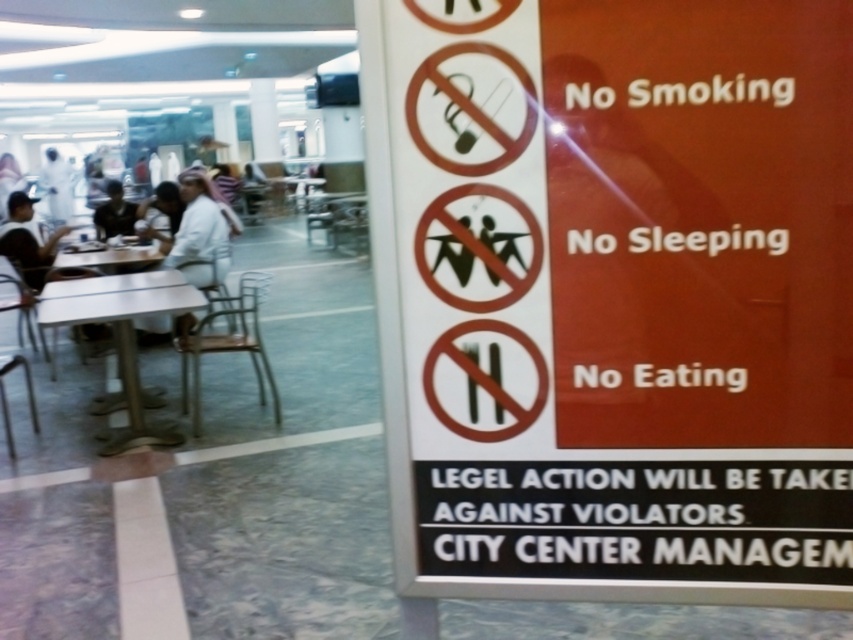
Question: Among these points, which one is nearest to the camera?

Choices:
 (A) (0, 236)
 (B) (167, 280)
 (C) (55, 262)

Answer: (B)

Question: Which point is closer to the camera?

Choices:
 (A) matte black cap at left
 (B) light blue fabric shirt at left

Answer: (A)

Question: Which object appears farthest from the camera in this image?

Choices:
 (A) orange matte sign at right
 (B) matte black cap at left
 (C) white glossy table at center
 (D) white fabric shirt at left

Answer: (B)

Question: Can you confirm if white plastic table at center is wider than light blue fabric shirt at left?

Choices:
 (A) no
 (B) yes

Answer: (B)

Question: Is white glossy table at center to the left of matte black cap at left from the viewer's perspective?

Choices:
 (A) no
 (B) yes

Answer: (A)

Question: Is orange matte sign at right below matte black cap at left?

Choices:
 (A) yes
 (B) no

Answer: (A)